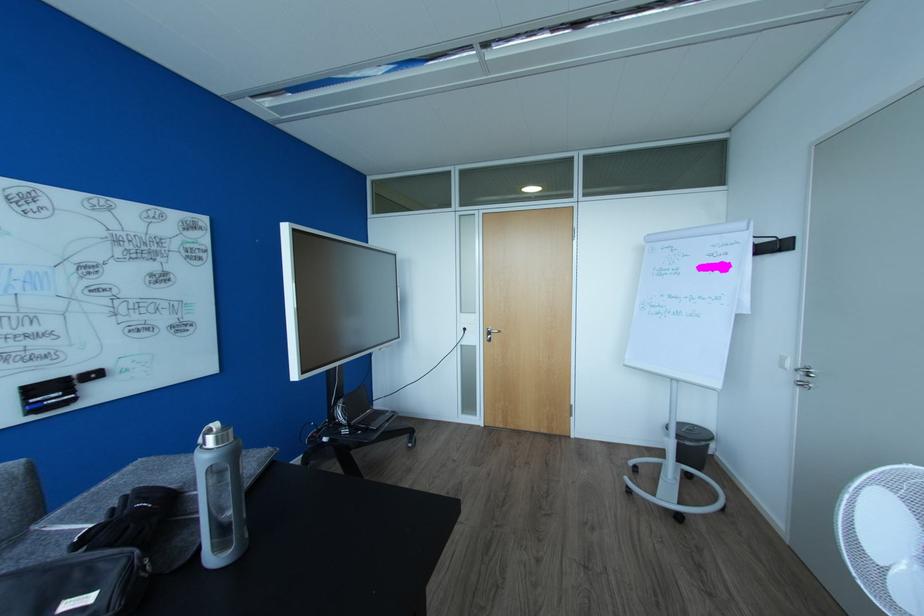
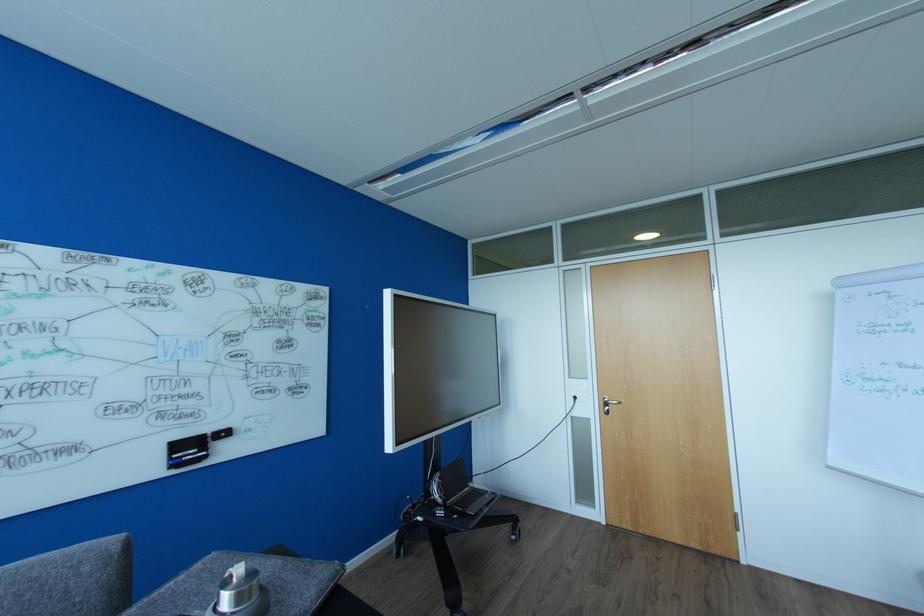
In the second image, find the point that corresponds to (493,333) in the first image.

(610, 403)